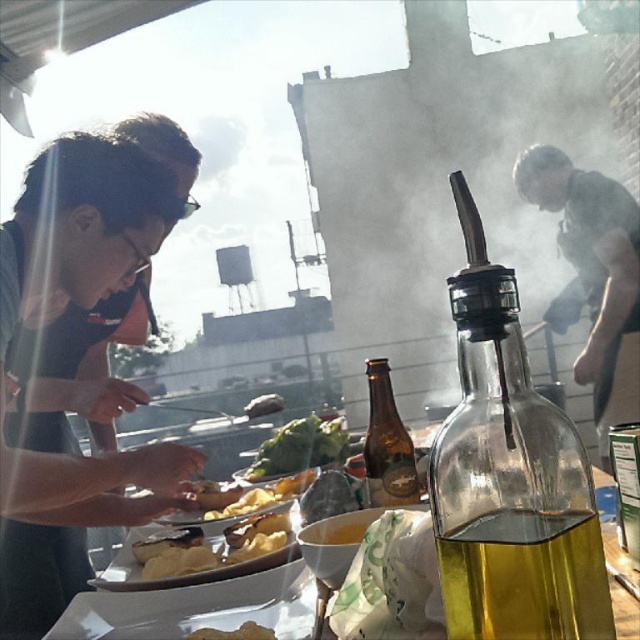
Question: Which object appears closest to the camera in this image?

Choices:
 (A) gray fabric shirt at upper right
 (B) green leafy vegetable at center

Answer: (B)

Question: Is translucent glass table at center bigger than yellow matte chips at center?

Choices:
 (A) yes
 (B) no

Answer: (A)

Question: Which point is closer to the camera?

Choices:
 (A) yellow matte bread at center
 (B) smoke at upper center
 (C) gray fabric shirt at upper right
 (D) clear glass bottle at center

Answer: (D)

Question: Can you confirm if smoke at upper center is positioned to the right of golden glass bottle at center?

Choices:
 (A) yes
 (B) no

Answer: (A)

Question: Which point is farther to the camera?

Choices:
 (A) (305, 540)
 (B) (259, 506)
 (C) (378, 378)

Answer: (B)

Question: Does gray fabric shirt at upper right have a larger size compared to yellow matte chips at center?

Choices:
 (A) yes
 (B) no

Answer: (A)